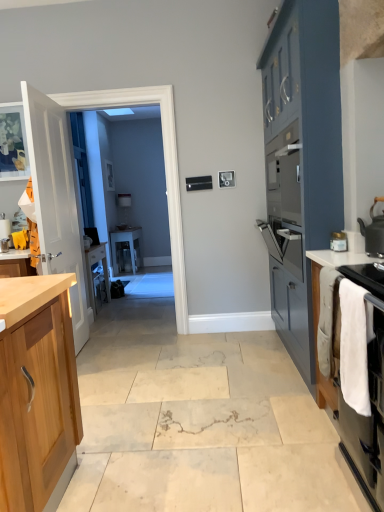
The width and height of the screenshot is (384, 512). I want to click on empty space that is ontop of beige marble floor at center, so click(185, 391).